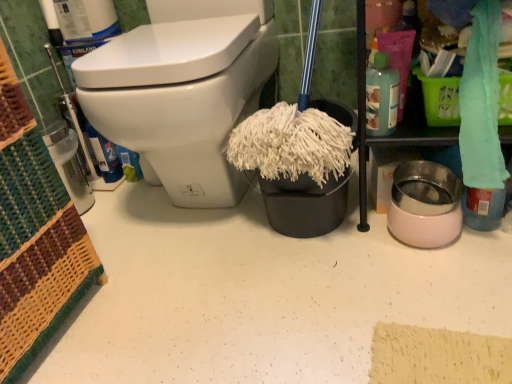
Find the location of a particular element. This screenshot has height=384, width=512. vacant region to the left of white fluffy mop head at center is located at coordinates (199, 236).